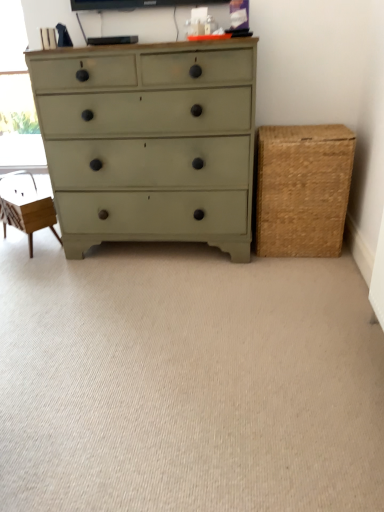
Question: Does beige carpet at center have a greater width compared to satin green dresser at center?

Choices:
 (A) no
 (B) yes

Answer: (B)

Question: Is beige carpet at center far from satin green dresser at center?

Choices:
 (A) no
 (B) yes

Answer: (A)

Question: From a real-world perspective, is beige carpet at center on satin green dresser at center?

Choices:
 (A) yes
 (B) no

Answer: (B)

Question: From the image's perspective, would you say beige carpet at center is positioned over satin green dresser at center?

Choices:
 (A) yes
 (B) no

Answer: (B)

Question: Is beige carpet at center aimed at satin green dresser at center?

Choices:
 (A) no
 (B) yes

Answer: (A)

Question: Is beige carpet at center oriented away from satin green dresser at center?

Choices:
 (A) yes
 (B) no

Answer: (B)

Question: Can you confirm if beige carpet at center is taller than braided wicker basket at right?

Choices:
 (A) no
 (B) yes

Answer: (A)

Question: Is beige carpet at center facing towards braided wicker basket at right?

Choices:
 (A) no
 (B) yes

Answer: (A)

Question: Can you see beige carpet at center touching braided wicker basket at right?

Choices:
 (A) no
 (B) yes

Answer: (A)

Question: From a real-world perspective, is beige carpet at center located beneath braided wicker basket at right?

Choices:
 (A) no
 (B) yes

Answer: (B)

Question: Does beige carpet at center appear on the right side of braided wicker basket at right?

Choices:
 (A) yes
 (B) no

Answer: (B)

Question: Can you confirm if beige carpet at center is thinner than braided wicker basket at right?

Choices:
 (A) no
 (B) yes

Answer: (A)

Question: Would you say braided wicker basket at right is a long distance from satin green dresser at center?

Choices:
 (A) no
 (B) yes

Answer: (A)